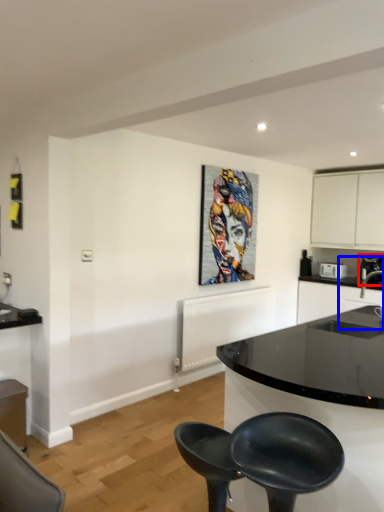
Question: Which object appears farthest to the camera in this image, coffee machine (highlighted by a red box) or sink (highlighted by a blue box)?

Choices:
 (A) coffee machine
 (B) sink

Answer: (A)